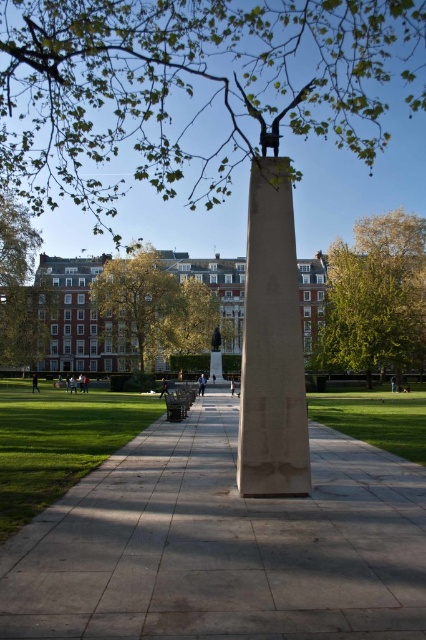
From the picture: You are standing at the obelisk structure in the park and want to walk to the point marked at coordinates point. Which direction should you head to reach point? (117, 492) from your current position at point (294, 412)?

To reach point (117, 492) from your current position at point (294, 412), you should head forward since point (117, 492) is behind point (294, 412).